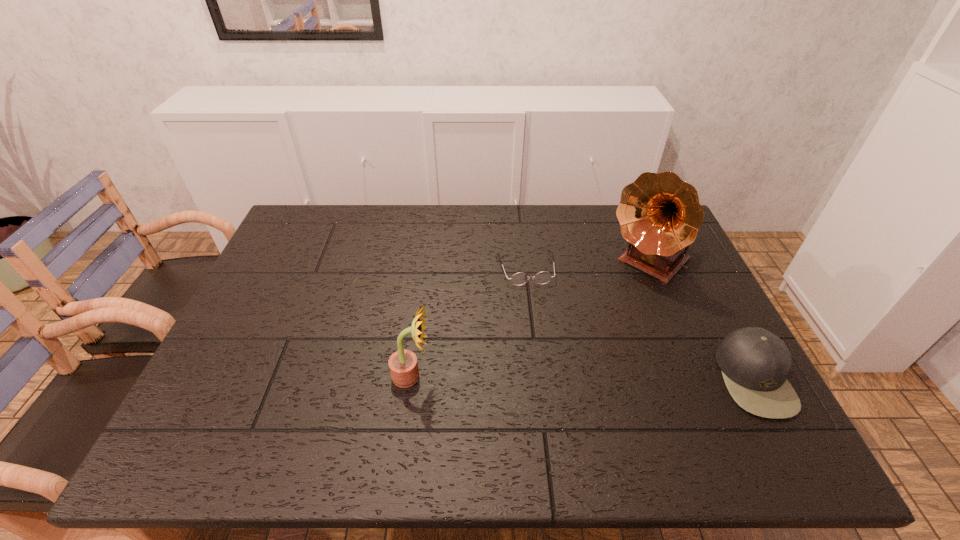
What are the coordinates of `free space between the second tallest object and the cap` in the screenshot? It's located at (583, 377).

Locate an element on the screen. This screenshot has width=960, height=540. vacant area that lies between the phonograph_record and the leftmost object is located at coordinates (531, 320).

Find the location of a particular element. Image resolution: width=960 pixels, height=540 pixels. free space between the leftmost object and the second shortest object is located at coordinates (583, 377).

Locate an element on the screen. The width and height of the screenshot is (960, 540). vacant area that lies between the cap and the shortest object is located at coordinates (640, 323).

At what (x,y) coordinates should I click in order to perform the action: click on free point between the cap and the sunflower. Please return your answer as a coordinate pair (x, y). Looking at the image, I should click on (583, 377).

Identify the location of free spot between the shortest object and the sunflower. The image size is (960, 540). (468, 322).

Where is `blank region between the tallest object and the spectacles`? This screenshot has height=540, width=960. blank region between the tallest object and the spectacles is located at coordinates (588, 266).

Locate an element on the screen. The image size is (960, 540). unoccupied position between the third tallest object and the sunflower is located at coordinates (583, 377).

Where is `vacant region between the cap and the shortest object`? vacant region between the cap and the shortest object is located at coordinates (640, 323).

This screenshot has height=540, width=960. I want to click on the third closest object to the phonograph_record, so click(x=403, y=365).